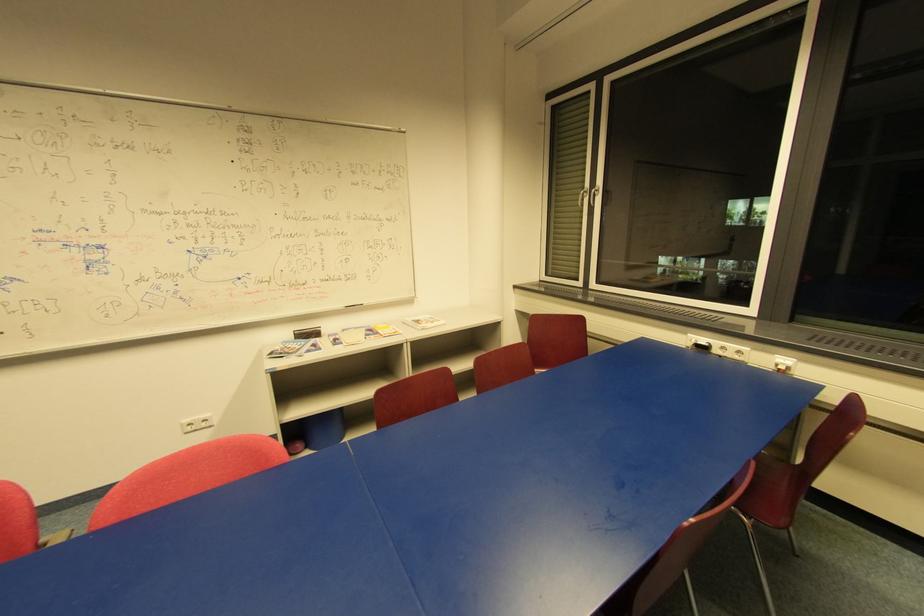
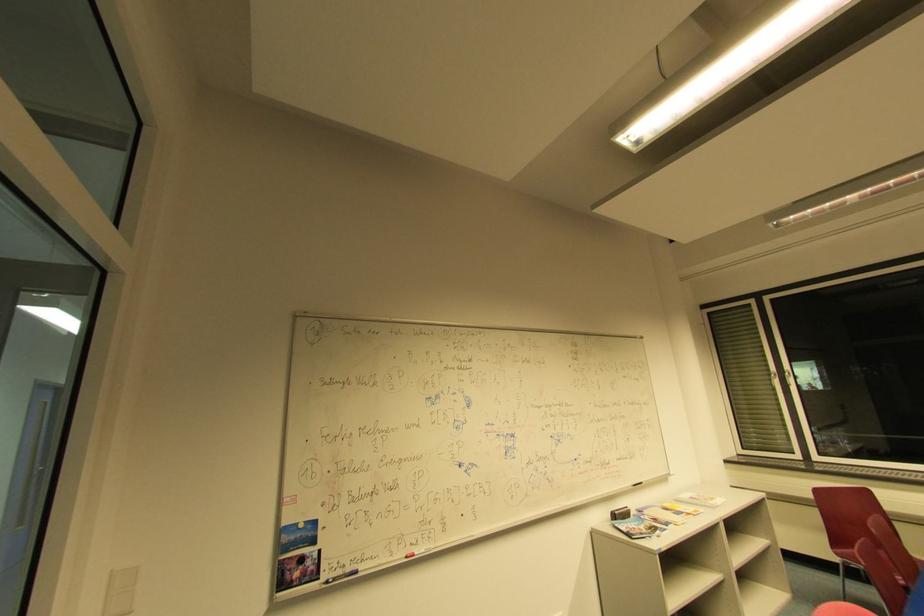
In the second image, find the point that corresponds to the point at 371,336 in the first image.

(679, 515)